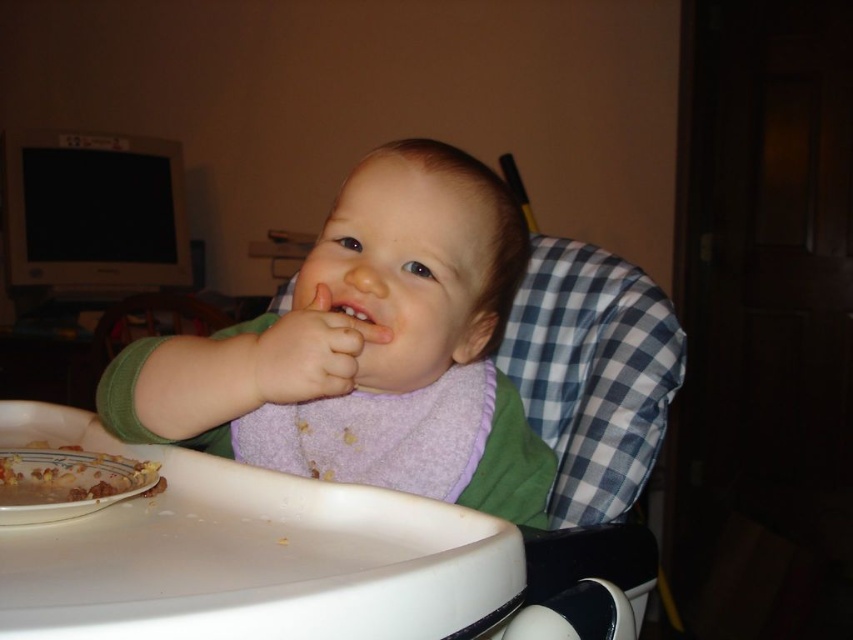
You are a parent trying to clean up after your baby. You need to reach both the purple fabric bib at center and the yellowish textured food at lower left. Given that your hand can only reach one object at a time, which object should you grab first to minimize the distance traveled?

You should grab the purple fabric bib at center first because it is closer to your hand than the yellowish textured food at lower left, so reaching it first would require less movement.

You are a photographer trying to capture the baby in the high chair. You notice two points of interest marked as point (426, 378) and point (79, 492). Which point is closer to the camera?

Point (426, 378) is further to the viewer than point (79, 492), so the point closer to the camera is point (79, 492).

You are a parent trying to clean up after your baby. You need to reach both the blue checkered fabric at center and the yellowish textured food at lower left. Which object will require you to reach higher?

The blue checkered fabric at center is much taller than the yellowish textured food at lower left, so you will need to reach higher to clean the blue checkered fabric at center.